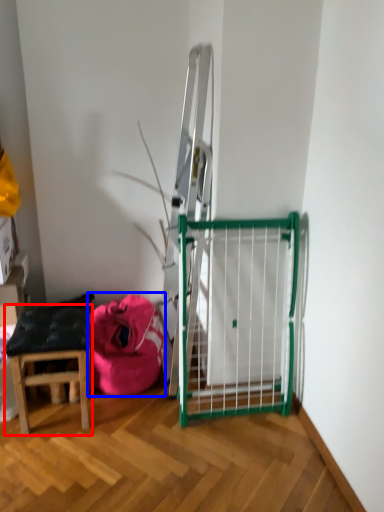
Question: Which object is further to the camera taking this photo, stool (highlighted by a red box) or bean bag chair (highlighted by a blue box)?

Choices:
 (A) stool
 (B) bean bag chair

Answer: (B)